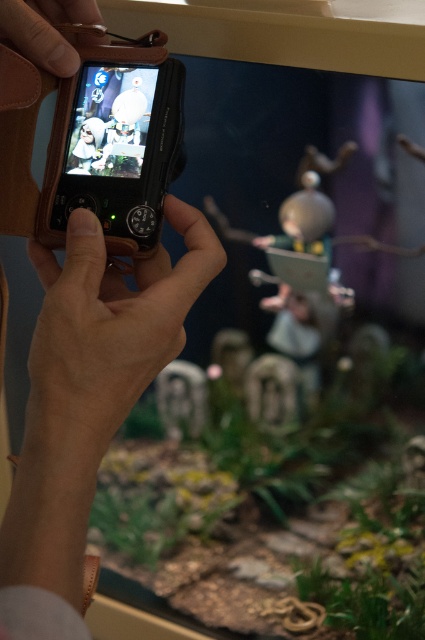
Question: Among these points, which one is nearest to the camera?

Choices:
 (A) (62, 61)
 (B) (161, 305)

Answer: (B)

Question: Which of the following is the farthest from the observer?

Choices:
 (A) leather at center
 (B) leather at upper left

Answer: (B)

Question: Where is leather at center located in relation to leather at upper left in the image?

Choices:
 (A) right
 (B) left

Answer: (A)

Question: Is leather at center to the left of leather at upper left from the viewer's perspective?

Choices:
 (A) no
 (B) yes

Answer: (A)

Question: Can you confirm if leather at center is positioned to the right of leather at upper left?

Choices:
 (A) yes
 (B) no

Answer: (A)

Question: Which object is farther from the camera taking this photo?

Choices:
 (A) leather at center
 (B) leather at upper left

Answer: (B)